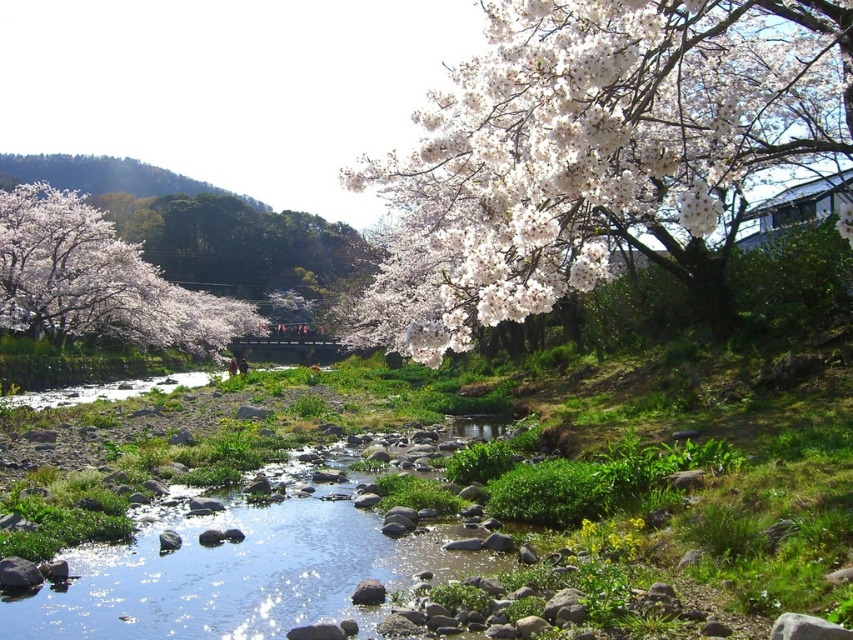
Question: Is the position of white matte flower at upper right more distant than that of white matte blossoms at left?

Choices:
 (A) yes
 (B) no

Answer: (B)

Question: Which object appears closest to the camera in this image?

Choices:
 (A) clear water at center
 (B) white matte blossoms at left

Answer: (A)

Question: Which is farther from the white matte blossoms at left?

Choices:
 (A) white matte flower at upper right
 (B) clear water at center

Answer: (B)

Question: Which point is farther to the camera?

Choices:
 (A) [329, 588]
 (B) [648, 232]
 (C) [61, 228]

Answer: (C)

Question: Is clear water at center thinner than white matte blossoms at left?

Choices:
 (A) no
 (B) yes

Answer: (B)

Question: Can you confirm if white matte flower at upper right is thinner than clear water at center?

Choices:
 (A) yes
 (B) no

Answer: (B)